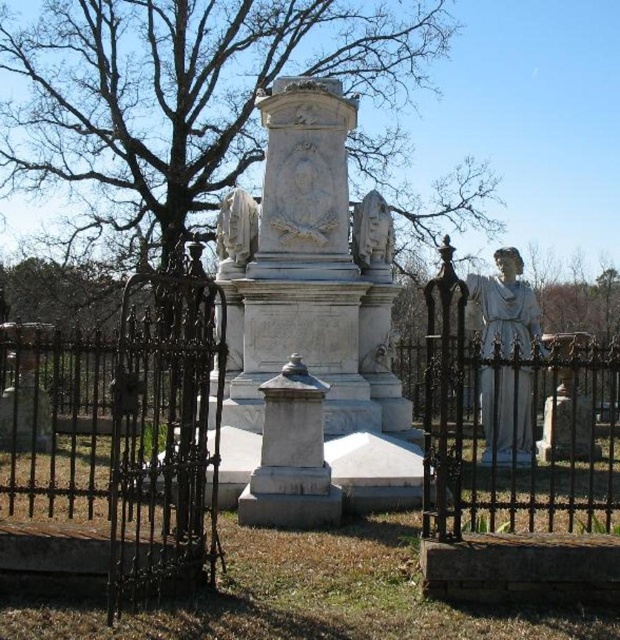
Question: Can you confirm if white marble monument at center is bigger than white marble statue at center?

Choices:
 (A) yes
 (B) no

Answer: (A)

Question: Among these objects, which one is nearest to the camera?

Choices:
 (A) black wrought iron fence at center
 (B) white marble statue at right

Answer: (A)

Question: Where is white marble monument at center located in relation to white marble statue at center in the image?

Choices:
 (A) right
 (B) left

Answer: (A)

Question: Which of the following is the closest to the observer?

Choices:
 (A) white marble monument at center
 (B) bare wood tree at center

Answer: (A)

Question: Can you confirm if black wrought iron fence at center is positioned to the left of white marble statue at center?

Choices:
 (A) yes
 (B) no

Answer: (B)

Question: Among these objects, which one is nearest to the camera?

Choices:
 (A) white marble monument at center
 (B) white marble statue at center
 (C) black wrought iron fence at center
 (D) bare wood tree at center

Answer: (C)